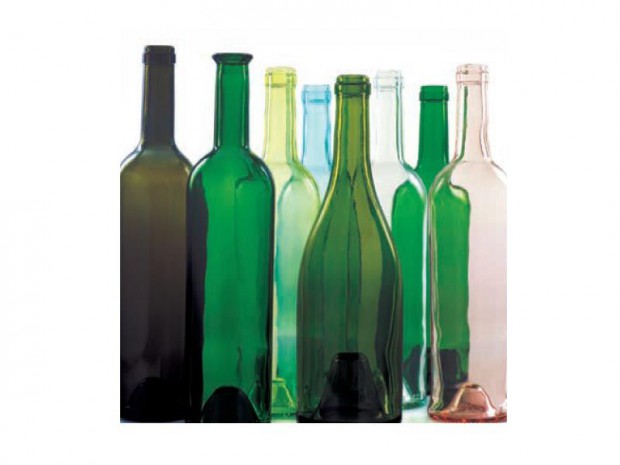
Locate an element on the screen. The width and height of the screenshot is (620, 465). glass bottles is located at coordinates (160, 317), (229, 267), (291, 221), (322, 165), (392, 194), (426, 162), (464, 215).